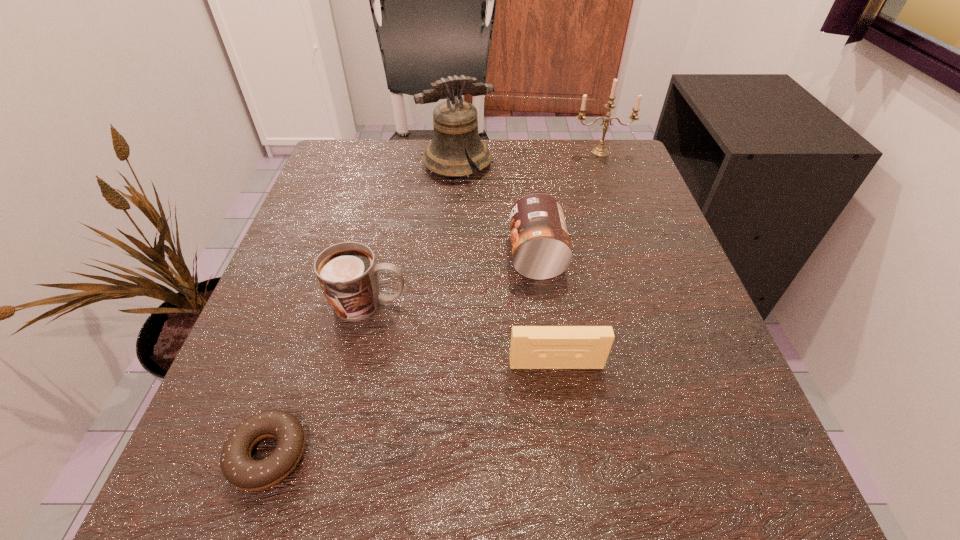
Where is `vacant area situated 0.290m on the side of the mug with the handle`? This screenshot has height=540, width=960. vacant area situated 0.290m on the side of the mug with the handle is located at coordinates (583, 303).

Locate an element on the screen. vacant position located on the front label of the can is located at coordinates (444, 255).

Find the location of a particular element. The height and width of the screenshot is (540, 960). vacant space located on the front label of the can is located at coordinates (379, 255).

You are a GUI agent. You are given a task and a screenshot of the screen. Output one action in this format:
    pyautogui.click(x=<x>, y=<y>)
    Task: Click on the vacant space situated on the front label of the can
    This screenshot has height=540, width=960.
    Given the screenshot: What is the action you would take?
    pyautogui.click(x=358, y=255)

This screenshot has width=960, height=540. I want to click on free region located 0.160m at the front of the videotape with spools, so click(x=573, y=487).

Find the location of `vacant space located on the back of the nearest object`. vacant space located on the back of the nearest object is located at coordinates (338, 247).

The width and height of the screenshot is (960, 540). What are the coordinates of `bell positioned at the far edge` in the screenshot? It's located at (455, 122).

Locate an element on the screen. candle that is at the far edge is located at coordinates (601, 151).

Locate an element on the screen. The height and width of the screenshot is (540, 960). object at the near edge is located at coordinates (243, 472).

This screenshot has width=960, height=540. In order to click on mug that is positioned at the left edge in this screenshot , I will do `click(347, 272)`.